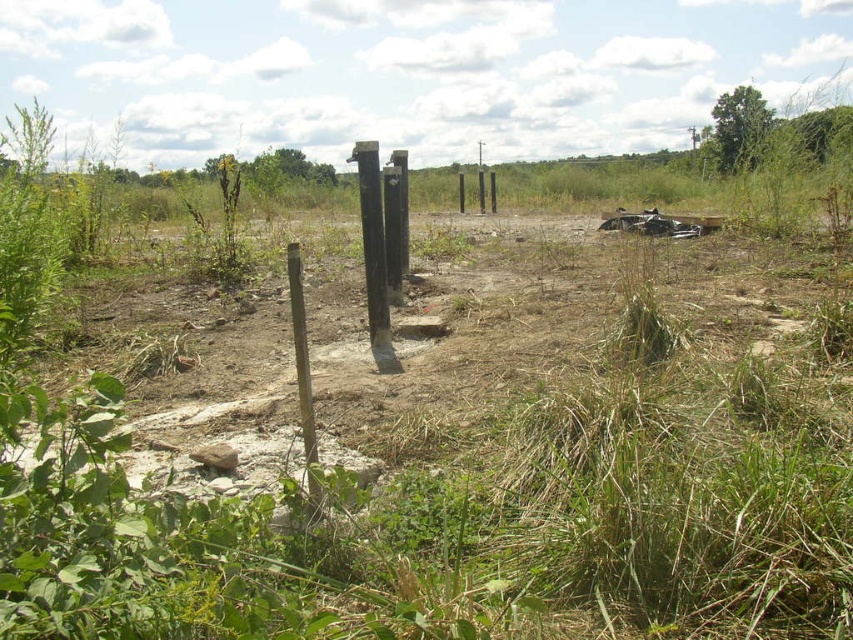
What are the coordinates of `brown dirt field at center` in the screenshot? It's located at (544, 326).

Which is above, brown dirt field at center or black wood post at center?

black wood post at center is above.

The height and width of the screenshot is (640, 853). Find the location of `brown dirt field at center`. brown dirt field at center is located at coordinates (544, 326).

Locate an element on the screen. This screenshot has height=640, width=853. brown dirt field at center is located at coordinates (544, 326).